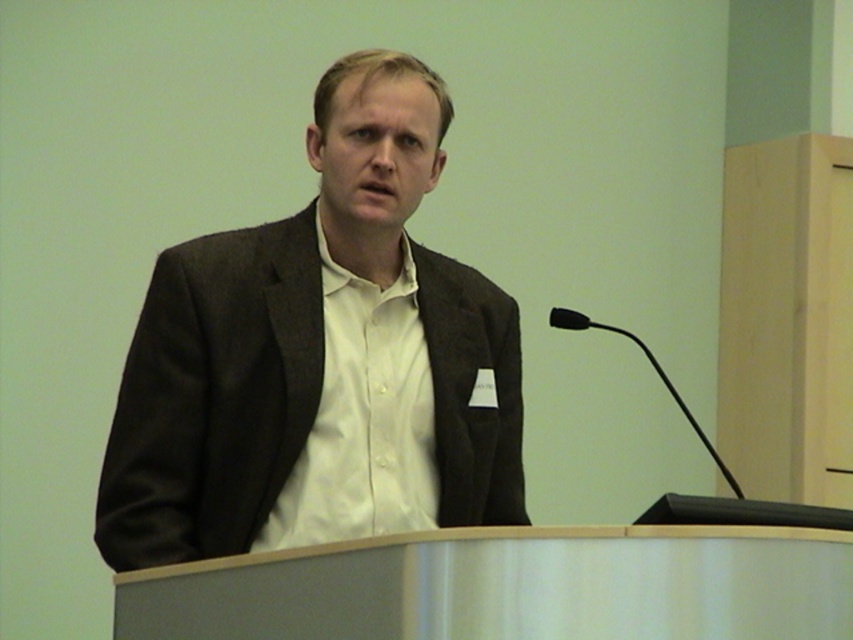
Between point (224, 484) and point (404, 269), which one is positioned behind?

Positioned behind is point (404, 269).

Does matte black suit at center appear on the left side of white smooth shirt at center?

Yes, matte black suit at center is to the left of white smooth shirt at center.

Locate an element on the screen. This screenshot has height=640, width=853. matte black suit at center is located at coordinates (x=318, y=358).